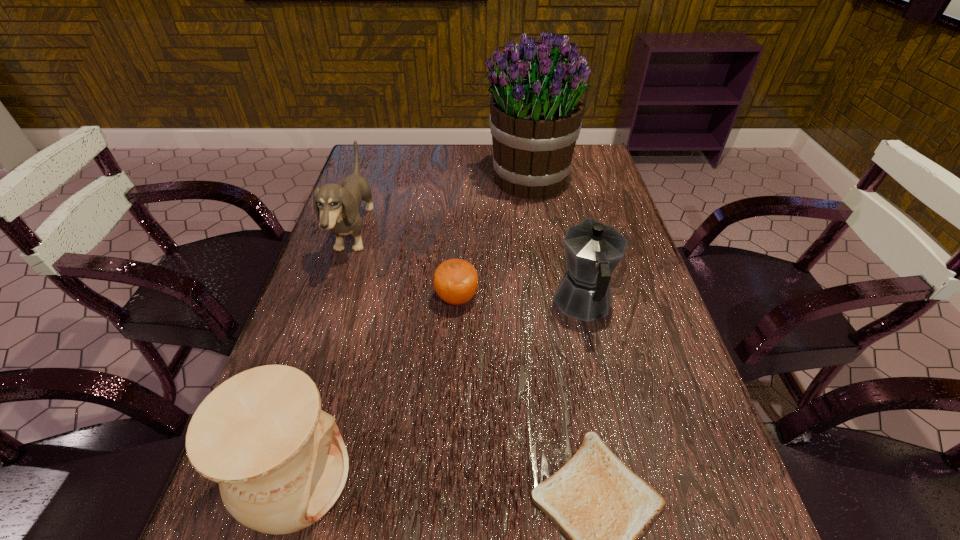
Locate an element on the screen. The image size is (960, 540). free space located 0.400m on the right of the fifth tallest object is located at coordinates (658, 298).

At what (x,y) coordinates should I click in order to perform the action: click on object located in the far edge section of the desktop. Please return your answer as a coordinate pair (x, y). The height and width of the screenshot is (540, 960). Looking at the image, I should click on (536, 109).

Find the location of a particular element. The width and height of the screenshot is (960, 540). object at the left edge is located at coordinates (337, 207).

Image resolution: width=960 pixels, height=540 pixels. I want to click on bouquet that is at the right edge, so click(x=536, y=109).

The height and width of the screenshot is (540, 960). I want to click on coffeepot located at the right edge, so click(x=593, y=250).

The height and width of the screenshot is (540, 960). Find the location of `object that is at the far right corner`. object that is at the far right corner is located at coordinates (536, 109).

In the image, there is a desktop. Identify the location of vacant space at the far edge. (443, 179).

Image resolution: width=960 pixels, height=540 pixels. In the image, there is a desktop. Identify the location of free space at the left edge. (350, 350).

Image resolution: width=960 pixels, height=540 pixels. Identify the location of free space at the right edge. (657, 333).

Find the location of `vacant region at the far left corner of the desktop`. vacant region at the far left corner of the desktop is located at coordinates (406, 171).